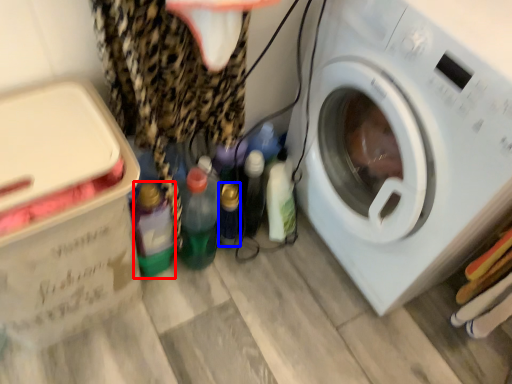
Question: Which point is further to the camera, bottle (highlighted by a red box) or bottle (highlighted by a blue box)?

Choices:
 (A) bottle
 (B) bottle

Answer: (B)